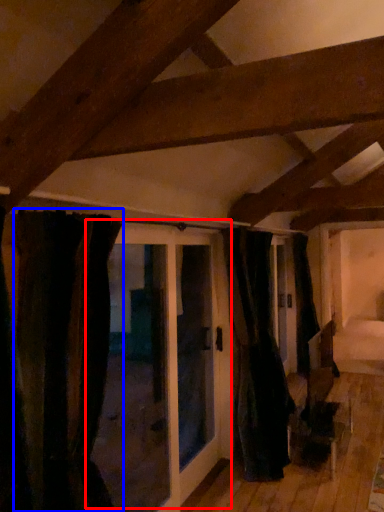
Question: Which object is closer to the camera taking this photo, door (highlighted by a red box) or curtain (highlighted by a blue box)?

Choices:
 (A) door
 (B) curtain

Answer: (B)